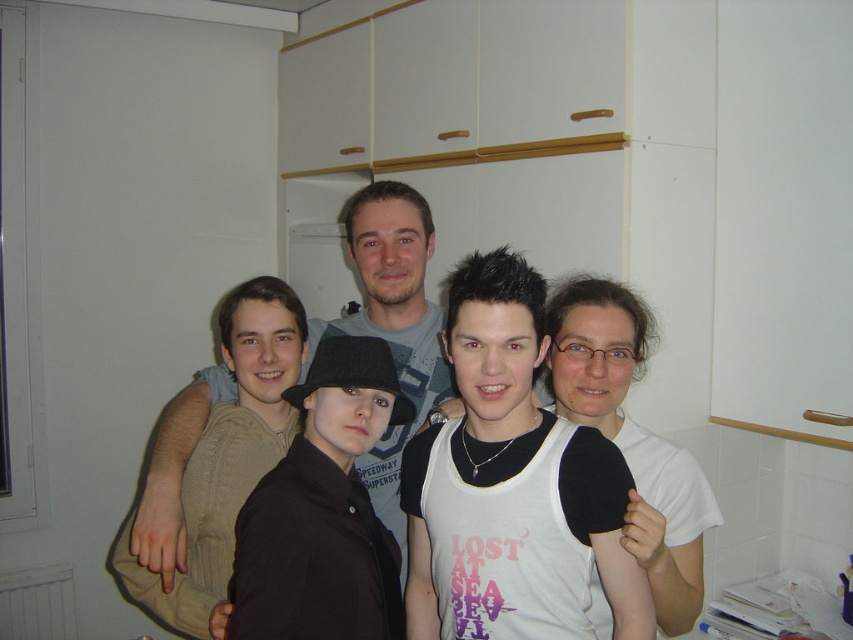
Which is below, black matte hat at center or matte gray shirt at center?

Positioned lower is black matte hat at center.

Between black matte hat at center and matte gray shirt at center, which one has less height?

black matte hat at center

Is point (392, 392) farther from camera compared to point (178, 470)?

No, (392, 392) is closer to viewer.

I want to click on black matte hat at center, so click(x=323, y=512).